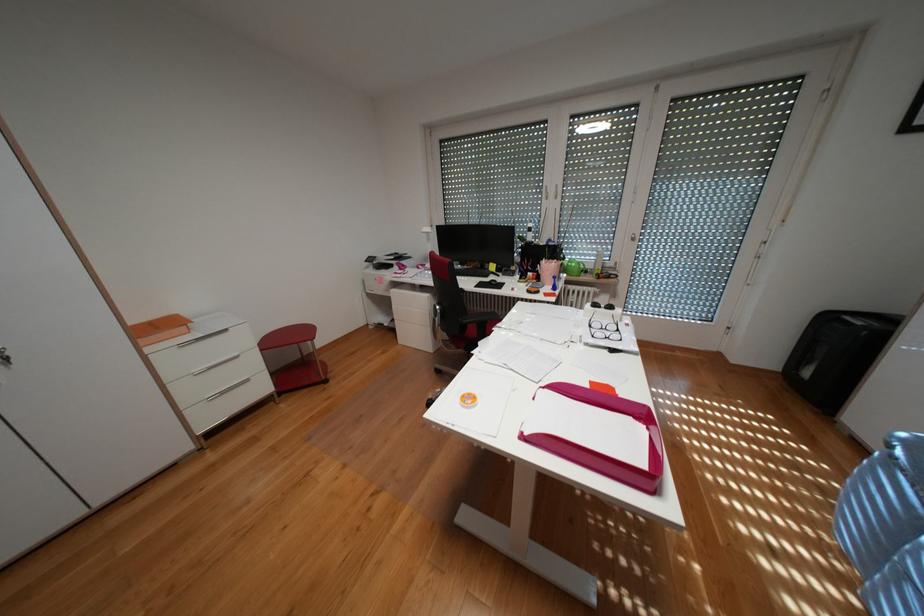
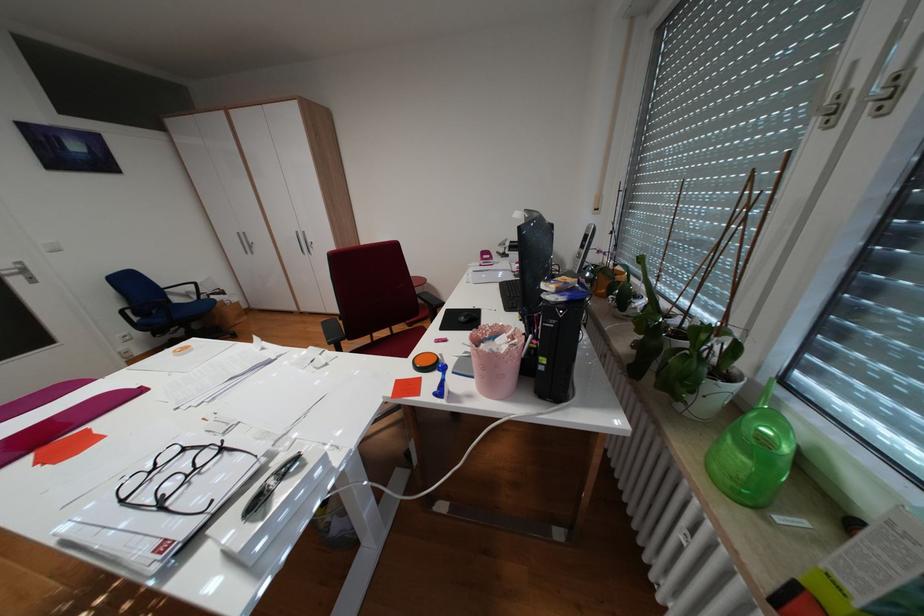
Where in the second image is the point corresponding to point 629,330 from the first image?

(173, 505)